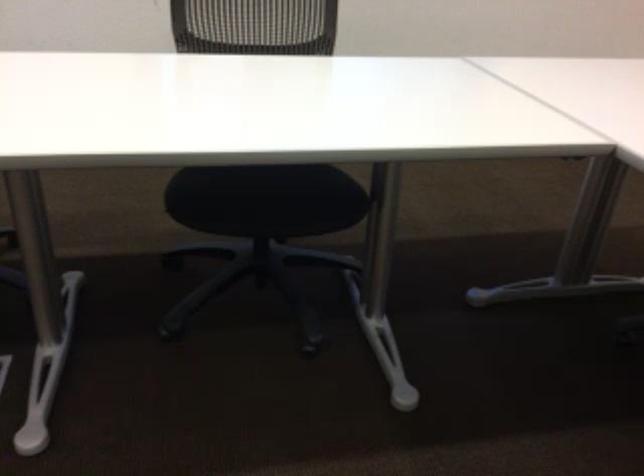
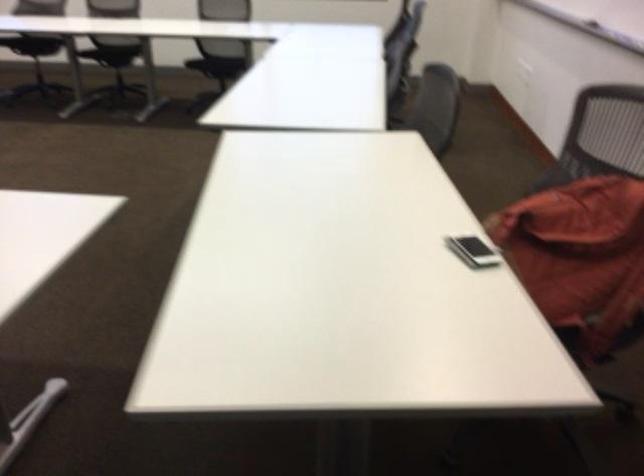
What movement of the cameraman would produce the second image?

The cameraman moved toward right, backward.